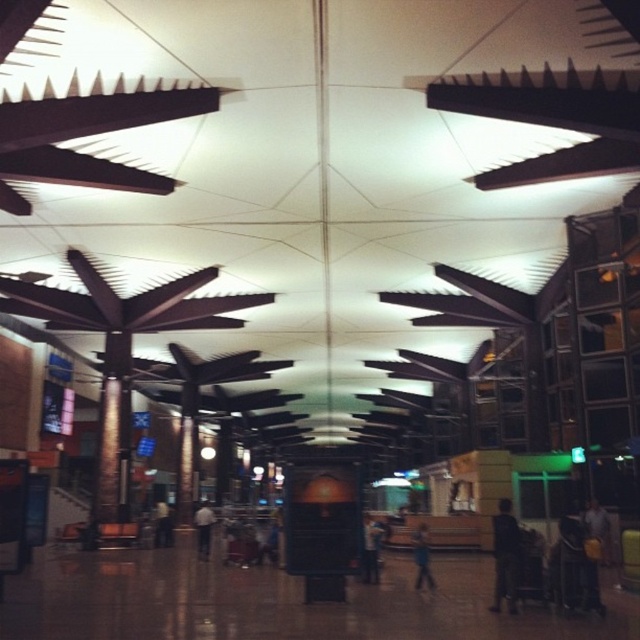
Between point (365, 557) and point (168, 506), which one is positioned behind?

The point (168, 506) is behind.

In the scene shown: Between dark blue jeans at center and dark gray suit at center, which one appears on the left side from the viewer's perspective?

dark gray suit at center

Image resolution: width=640 pixels, height=640 pixels. Describe the element at coordinates (371, 548) in the screenshot. I see `dark blue jeans at center` at that location.

This screenshot has height=640, width=640. Find the location of `dark blue jeans at center`. dark blue jeans at center is located at coordinates (371, 548).

Does point (586, 556) lie behind point (376, 531)?

No, it is in front of (376, 531).

Is point (596, 563) in front of point (372, 529)?

Yes, it is.

Image resolution: width=640 pixels, height=640 pixels. What do you see at coordinates (593, 550) in the screenshot?
I see `dark gray fabric jacket at right` at bounding box center [593, 550].

The image size is (640, 640). Identify the location of dark gray fabric jacket at right. (593, 550).

Can you confirm if dark gray fabric jacket at right is taller than blue fabric person at center?

Correct, dark gray fabric jacket at right is much taller as blue fabric person at center.

Is dark gray fabric jacket at right in front of blue fabric person at center?

Yes, dark gray fabric jacket at right is in front of blue fabric person at center.

What are the coordinates of `dark gray fabric jacket at right` in the screenshot? It's located at 593,550.

This screenshot has width=640, height=640. I want to click on dark gray fabric jacket at right, so click(593, 550).